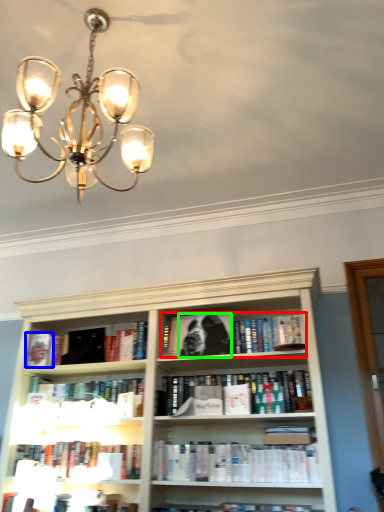
Question: Which object is the closest to the book (highlighted by a red box)? Choose among these: paperback book (highlighted by a blue box) or dog (highlighted by a green box).

Choices:
 (A) paperback book
 (B) dog

Answer: (B)